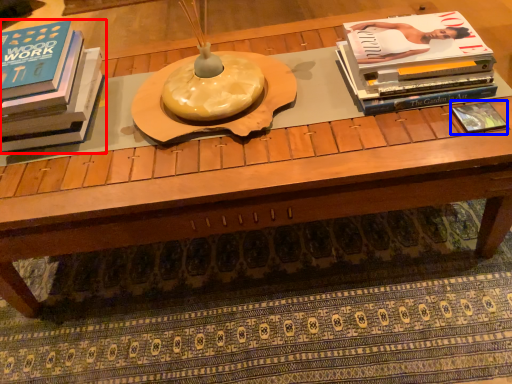
Question: Which object appears farthest to the camera in this image, book (highlighted by a red box) or book (highlighted by a blue box)?

Choices:
 (A) book
 (B) book

Answer: (B)